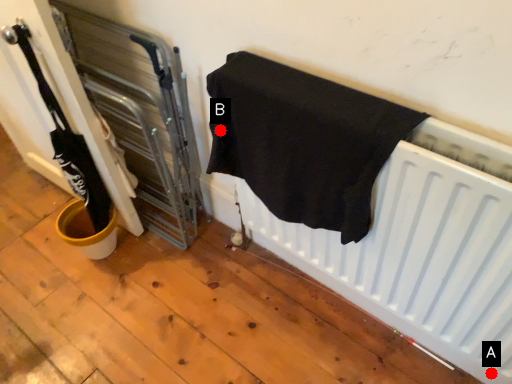
Question: Two points are circled on the image, labeled by A and B beside each circle. Which point is closer to the camera taking this photo?

Choices:
 (A) A is closer
 (B) B is closer

Answer: (A)